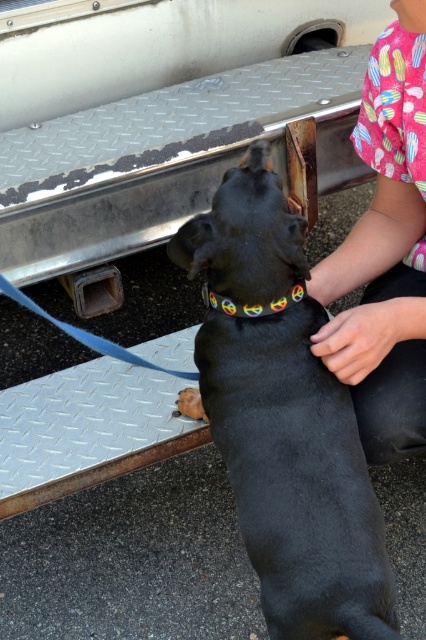
Can you confirm if black rubber dog at center is bigger than rainbow fabric neckband at upper center?

Correct, black rubber dog at center is larger in size than rainbow fabric neckband at upper center.

Looking at this image, measure the distance between black rubber dog at center and rainbow fabric neckband at upper center.

They are 8.05 inches apart.

Which is in front, point (265, 166) or point (288, 294)?

Positioned in front is point (288, 294).

What are the coordinates of `black rubber dog at center` in the screenshot? It's located at pos(296,476).

Does black rubber dog at center appear under pink fabric shirt at upper right?

Correct, black rubber dog at center is located below pink fabric shirt at upper right.

Which is in front, point (278, 180) or point (333, 298)?

Point (278, 180) is more forward.

Identify the location of black rubber dog at center. (296, 476).

I want to click on black rubber dog at center, so click(x=296, y=476).

Is pink fabric shirt at upper right above rainbow fabric neckband at upper center?

Indeed, pink fabric shirt at upper right is positioned over rainbow fabric neckband at upper center.

Can you confirm if pink fabric shirt at upper right is positioned to the left of rainbow fabric neckband at upper center?

In fact, pink fabric shirt at upper right is to the right of rainbow fabric neckband at upper center.

Who is more distant from viewer, (383, 74) or (230, 305)?

Point (383, 74)

Find the location of `pink fabric shirt at upper right`. pink fabric shirt at upper right is located at coordinates (385, 252).